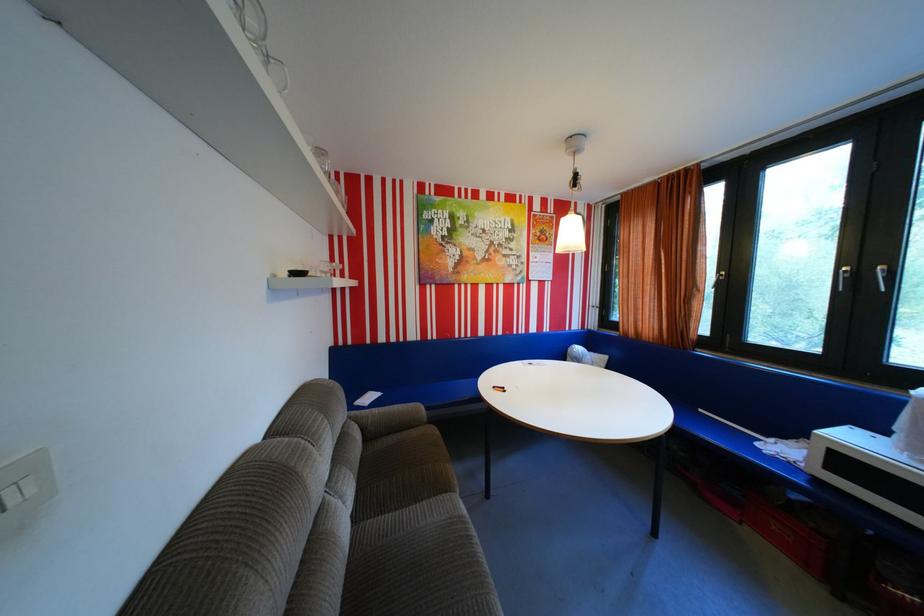
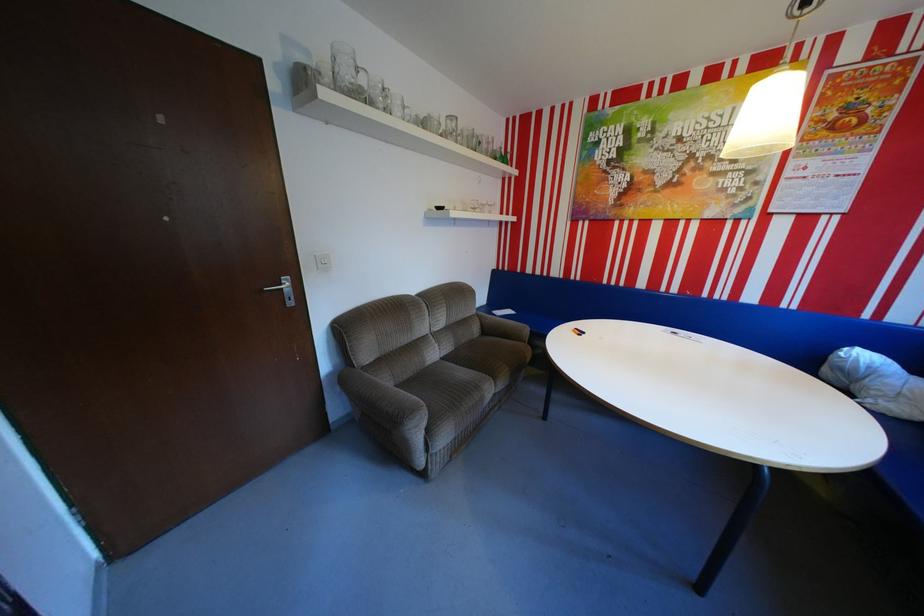
Where in the second image is the point corresponding to [371,400] from the first image?

(506, 310)